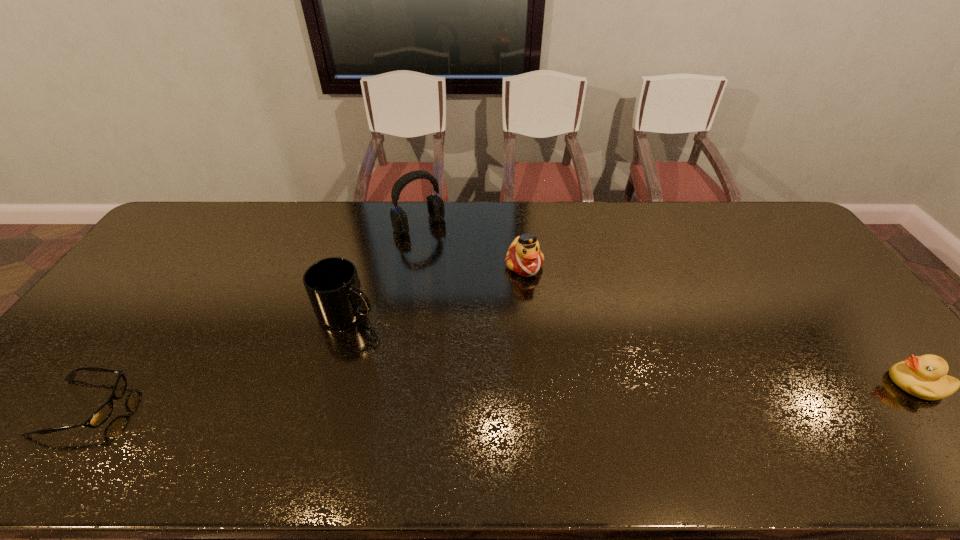
The image size is (960, 540). Find the location of `vacant space located on the headband of the tallest object`. vacant space located on the headband of the tallest object is located at coordinates (441, 245).

Locate an element on the screen. The image size is (960, 540). vacant space situated on the headband of the tallest object is located at coordinates (491, 299).

Find the location of `object located in the far edge section of the desktop`. object located in the far edge section of the desktop is located at coordinates click(435, 205).

Locate an element on the screen. This screenshot has height=540, width=960. spectacles present at the near edge is located at coordinates (101, 415).

Find the location of a particular element. duckling situated at the near edge is located at coordinates (924, 376).

Where is `object that is at the left edge`? The image size is (960, 540). object that is at the left edge is located at coordinates (101, 415).

This screenshot has width=960, height=540. Identify the location of object present at the right edge. tap(924, 376).

Where is `object located at the near left corner`? object located at the near left corner is located at coordinates (101, 415).

Where is `object that is at the near right corner`? object that is at the near right corner is located at coordinates (924, 376).

Locate an element on the screen. This screenshot has width=960, height=540. free space at the far edge of the desktop is located at coordinates (514, 224).